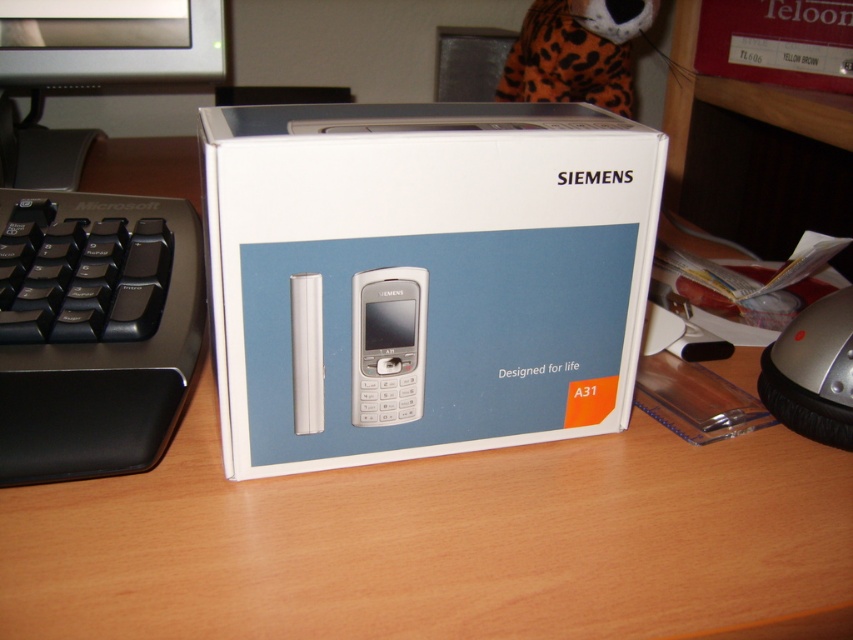
Question: Considering the real-world distances, which object is closest to the silver metallic mouse at lower right?

Choices:
 (A) silver metallic phone at center
 (B) white cardboard box at center
 (C) matte silver monitor at upper left
 (D) black plastic monitor at upper left

Answer: (B)

Question: Does matte silver monitor at upper left have a smaller size compared to silver metallic mouse at lower right?

Choices:
 (A) yes
 (B) no

Answer: (B)

Question: Does matte silver monitor at upper left appear on the right side of silver metallic mouse at lower right?

Choices:
 (A) yes
 (B) no

Answer: (B)

Question: Which object is farther from the camera taking this photo?

Choices:
 (A) matte silver monitor at upper left
 (B) black plastic keyboard at left
 (C) white cardboard box at center

Answer: (A)

Question: Is black plastic keyboard at left positioned behind silver metallic phone at center?

Choices:
 (A) no
 (B) yes

Answer: (A)

Question: Which object is positioned closest to the black plastic monitor at upper left?

Choices:
 (A) black plastic keyboard at left
 (B) white cardboard box at center

Answer: (A)